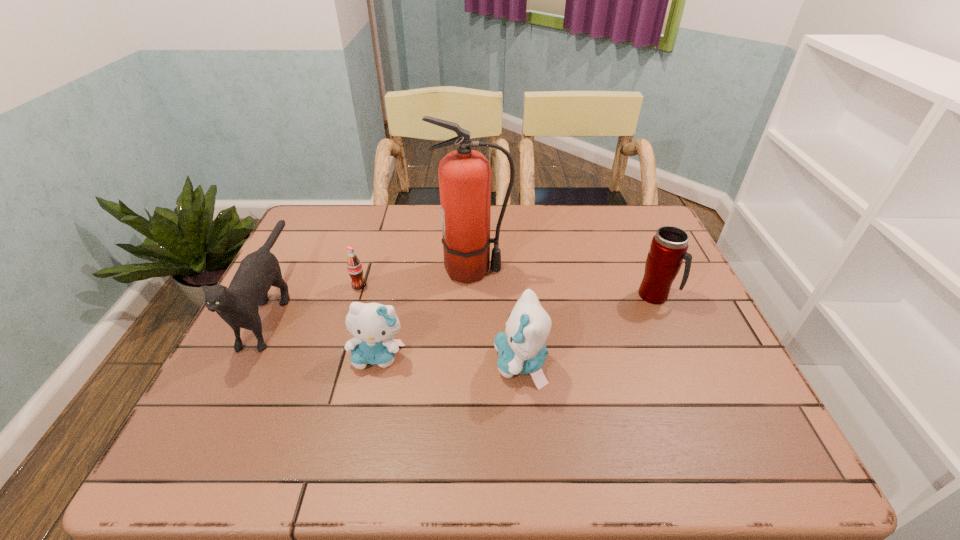
You are a GUI agent. You are given a task and a screenshot of the screen. Output one action in this format:
    pyautogui.click(x=<x>, y=<y>)
    Task: Click on the left kitten
    
    Given the screenshot: What is the action you would take?
    pyautogui.click(x=373, y=325)

The image size is (960, 540). I want to click on the second shortest object, so pyautogui.click(x=373, y=325).

Where is `the right kitten`? Image resolution: width=960 pixels, height=540 pixels. the right kitten is located at coordinates (522, 350).

Where is `cat`? The image size is (960, 540). cat is located at coordinates (238, 305).

Where is `the second object from left to right`? This screenshot has height=540, width=960. the second object from left to right is located at coordinates (354, 266).

Where is `the shortest object`? the shortest object is located at coordinates (354, 266).

I want to click on the rightmost object, so click(x=669, y=246).

The width and height of the screenshot is (960, 540). Find the location of `the tallest object`. the tallest object is located at coordinates (464, 175).

Where is `vacant space located 0.100m on the face of the shorter kitten`? vacant space located 0.100m on the face of the shorter kitten is located at coordinates (365, 413).

Image resolution: width=960 pixels, height=540 pixels. What are the coordinates of `vacant space located on the face of the right kitten` in the screenshot? It's located at (323, 363).